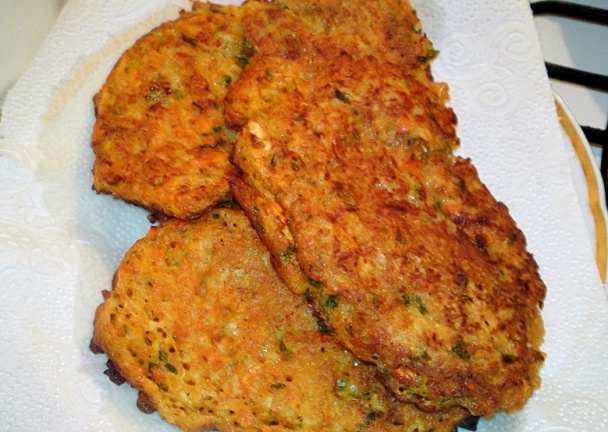
Find the location of a particular element. This screenshot has height=432, width=608. paper towel white with grease on it is located at coordinates (132, 232).